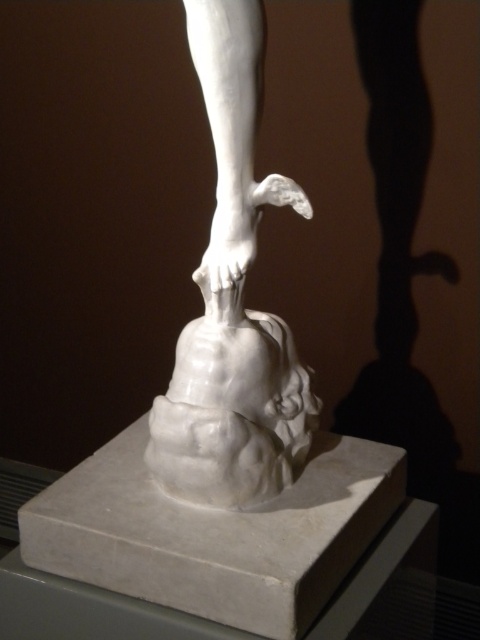
You are an art student observing the sculpture and the person in the image. Which object is taller between the white marble sculpture at center and the white marble person at center?

The white marble sculpture at center is much taller than the white marble person at center.

You are an art curator assessing the spatial arrangement of the sculpture display. The white marble sculpture at center and the white marble person at center are both displayed on the same pedestal. Which object occupies more horizontal space on the pedestal?

The white marble person at center occupies more horizontal space on the pedestal than the white marble sculpture at center because it has a greater width according to the description.

You are standing in front of an art gallery and see the white marble sculpture at center displayed on a square pedestal. If you were to walk directly towards the sculpture, which direction should you move relative to your current position?

Since the white marble sculpture at center is located at point coordinates of (232, 301), you should move forward directly towards the center of the image to reach it.